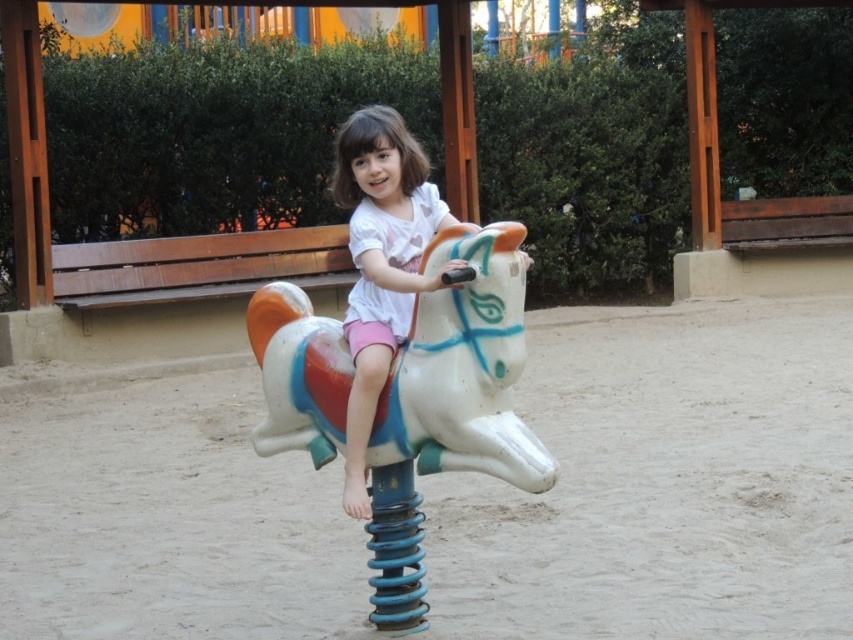
Question: Does white sandy ground at center appear under white plastic horse at center?

Choices:
 (A) yes
 (B) no

Answer: (A)

Question: Does white sandy ground at center have a lesser width compared to white plastic horse at center?

Choices:
 (A) yes
 (B) no

Answer: (A)

Question: Among these points, which one is farthest from the camera?

Choices:
 (A) (529, 433)
 (B) (346, 182)

Answer: (B)

Question: Is white sandy ground at center smaller than matte white horse at center?

Choices:
 (A) no
 (B) yes

Answer: (B)

Question: Which is farther from the white sandy ground at center?

Choices:
 (A) white plastic horse at center
 (B) matte white horse at center

Answer: (B)

Question: Which of the following is the closest to the observer?

Choices:
 (A) matte white horse at center
 (B) white sandy ground at center
 (C) white plastic horse at center

Answer: (C)